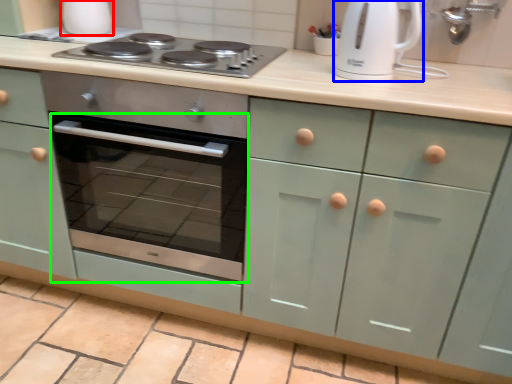
Question: Estimate the real-world distances between objects in this image. Which object is closer to appliance (highlighted by a red box), kitchen appliance (highlighted by a blue box) or oven (highlighted by a green box)?

Choices:
 (A) kitchen appliance
 (B) oven

Answer: (B)